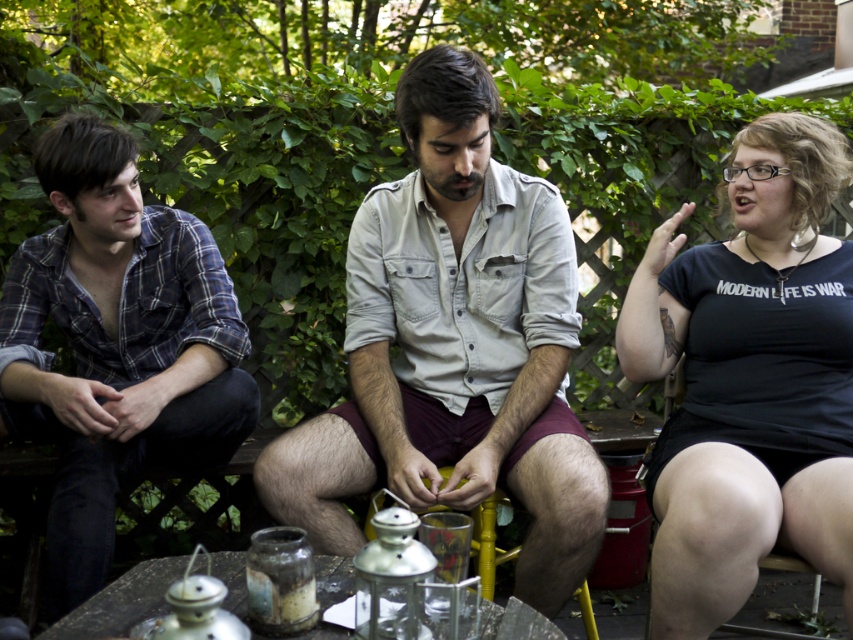
You are taking a photo of the three people sitting around the small wooden table in the garden. You want to focus on the person at point (753, 477) and the person at point (119, 593). Which of these two points should you focus on first to ensure both are in sharp focus?

You should focus on the point (753, 477) first because it is closer to the camera than point (119, 593). By focusing on the closer point, both subjects will be in sharp focus.

You are a photographer setting up a camera to capture a group photo of the light gray cotton shirt at center and the black matte shirt at right. The camera has a maximum width capacity of 2 meters. Can both individuals fit within the frame without any adjustments?

The light gray cotton shirt at center might be wider than black matte shirt at right. However, since the exact width difference isn not specified, it is uncertain whether their combined width exceeds the 2 meter limit. Further measurement is needed to confirm.

Based on the scene description, where is the light gray cotton shirt at center located in terms of coordinates?

The light gray cotton shirt at center is located at coordinates point (454,346).